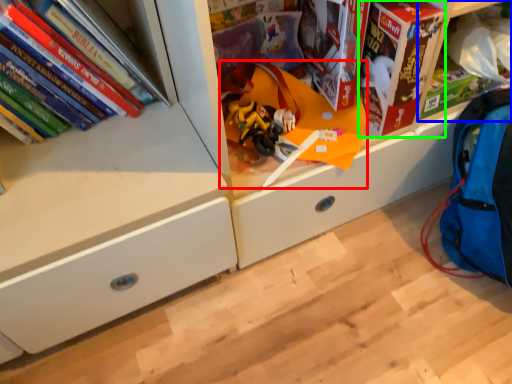
Question: Considering the real-world distances, which object is closest to toy (highlighted by a red box)? shelf (highlighted by a blue box) or paperback book (highlighted by a green box).

Choices:
 (A) shelf
 (B) paperback book

Answer: (B)